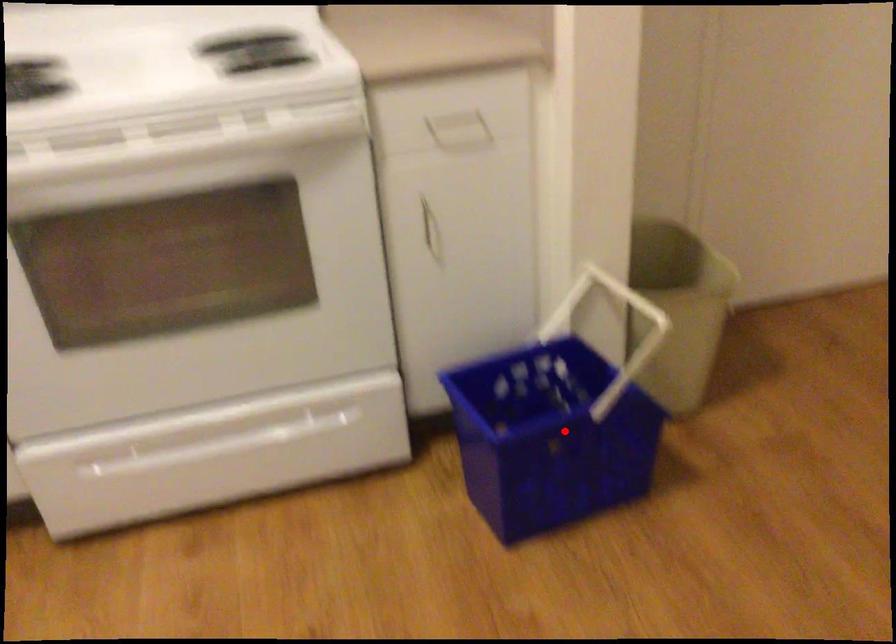
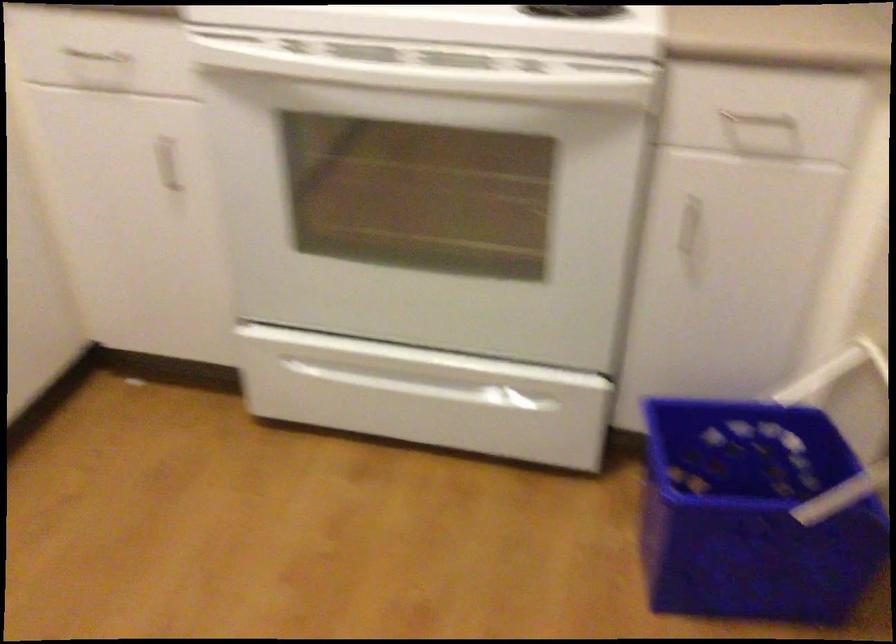
Find the pixel in the second image that matches the highlighted location in the first image.

(752, 514)